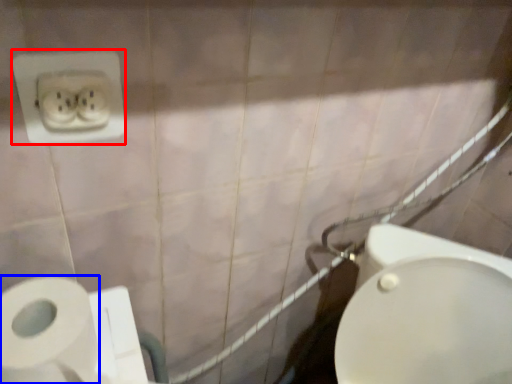
Question: Which of the following is the farthest to the observer, power plugs and sockets (highlighted by a red box) or toilet paper (highlighted by a blue box)?

Choices:
 (A) power plugs and sockets
 (B) toilet paper

Answer: (A)